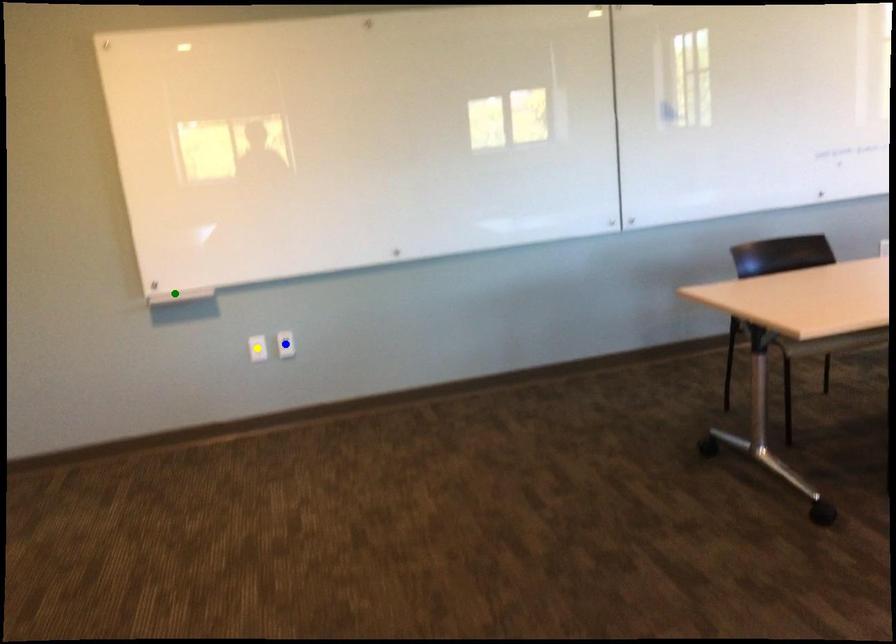
Based on the photo, order these from farthest to nearest:
yellow point | blue point | green point

blue point < yellow point < green point